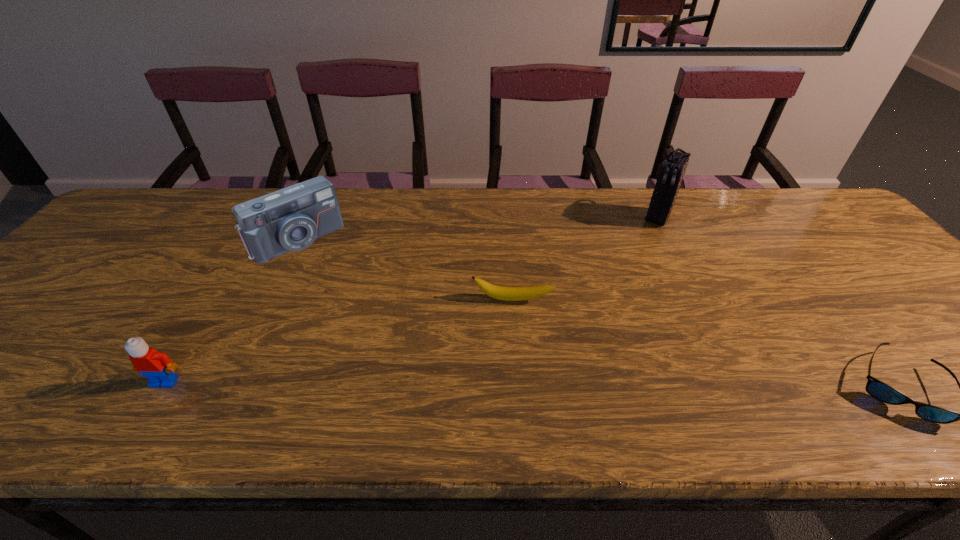
This screenshot has height=540, width=960. I want to click on free space on the desktop that is between the Lego and the shortest object and is positioned on the lens of the camera, so click(422, 383).

Where is `free space on the desktop that is between the third tallest object and the rightmost object and is positioned with the zip open on the second object from right to left`? The image size is (960, 540). free space on the desktop that is between the third tallest object and the rightmost object and is positioned with the zip open on the second object from right to left is located at coordinates (551, 384).

The height and width of the screenshot is (540, 960). Find the location of `free space on the desktop that is between the third tallest object and the sunglasses and is positioned on the upward curve of the third nearest object`. free space on the desktop that is between the third tallest object and the sunglasses and is positioned on the upward curve of the third nearest object is located at coordinates pyautogui.click(x=507, y=384).